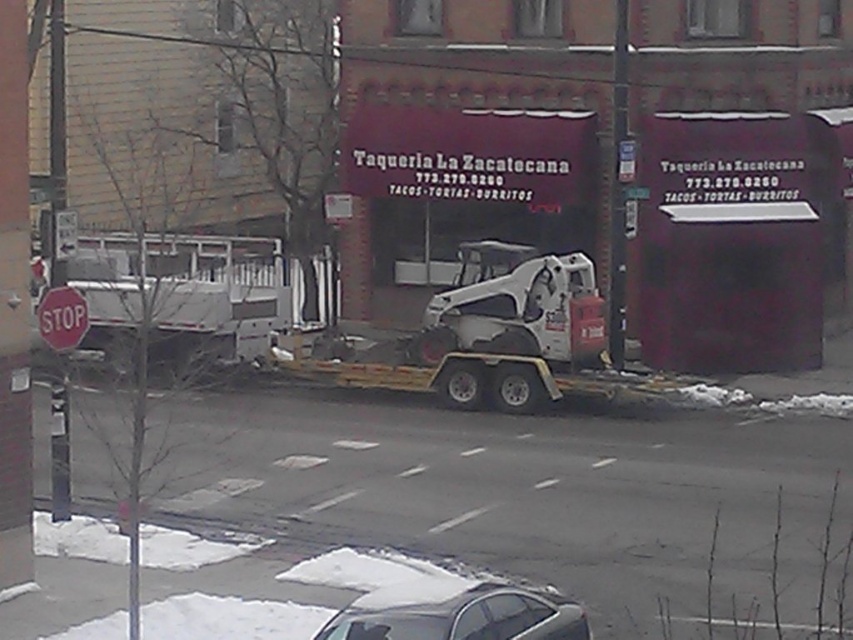
Who is taller, white matte trailer truck at left or silver metallic car at lower center?

white matte trailer truck at left

Does white matte trailer truck at left have a lesser width compared to silver metallic car at lower center?

Incorrect, white matte trailer truck at left's width is not less than silver metallic car at lower center's.

Image resolution: width=853 pixels, height=640 pixels. In order to click on white matte trailer truck at left in this screenshot , I will do `click(183, 292)`.

Which is below, white matte skid steer loader at center or silver metallic car at lower center?

silver metallic car at lower center is lower down.

Between point (556, 276) and point (469, 589), which one is positioned in front?

Point (469, 589)

Which is behind, point (468, 298) or point (445, 630)?

The point (468, 298) is more distant.

Locate an element on the screen. Image resolution: width=853 pixels, height=640 pixels. white matte skid steer loader at center is located at coordinates (521, 304).

Consider the image. Can you confirm if silver metallic car at lower center is shorter than red matte stop sign at lower left?

Yes, silver metallic car at lower center is shorter than red matte stop sign at lower left.

Measure the distance from silver metallic car at lower center to red matte stop sign at lower left.

→ silver metallic car at lower center is 6.61 meters from red matte stop sign at lower left.

The image size is (853, 640). What do you see at coordinates (466, 616) in the screenshot? I see `silver metallic car at lower center` at bounding box center [466, 616].

Locate an element on the screen. This screenshot has width=853, height=640. silver metallic car at lower center is located at coordinates (466, 616).